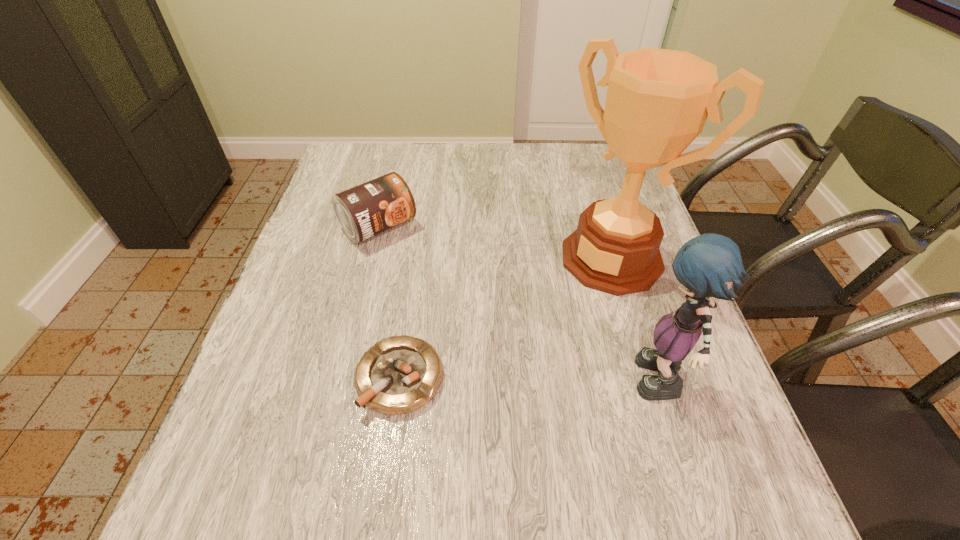
Where is `free space located on the front label of the can`? free space located on the front label of the can is located at coordinates (448, 295).

You are a GUI agent. You are given a task and a screenshot of the screen. Output one action in this format:
    pyautogui.click(x=<x>, y=<y>)
    Task: Click on the vacant point located 0.350m on the front-facing side of the tallest object
    
    Given the screenshot: What is the action you would take?
    click(483, 388)

Where is `free spot located 0.050m on the front-facing side of the tallest object`? The width and height of the screenshot is (960, 540). free spot located 0.050m on the front-facing side of the tallest object is located at coordinates (570, 299).

Image resolution: width=960 pixels, height=540 pixels. What are the coordinates of `free space located on the front-facing side of the tallest object` in the screenshot? It's located at (490, 381).

This screenshot has width=960, height=540. Find the location of `ashtray that is positioned at the near edge`. ashtray that is positioned at the near edge is located at coordinates (400, 374).

I want to click on rag doll that is at the near edge, so click(709, 265).

The image size is (960, 540). I want to click on object present at the left edge, so click(x=373, y=207).

Identify the location of rag doll present at the right edge. pos(709,265).

Locate an element on the screen. The width and height of the screenshot is (960, 540). award at the right edge is located at coordinates (657, 102).

Locate an element on the screen. The width and height of the screenshot is (960, 540). object that is at the near right corner is located at coordinates (709, 265).